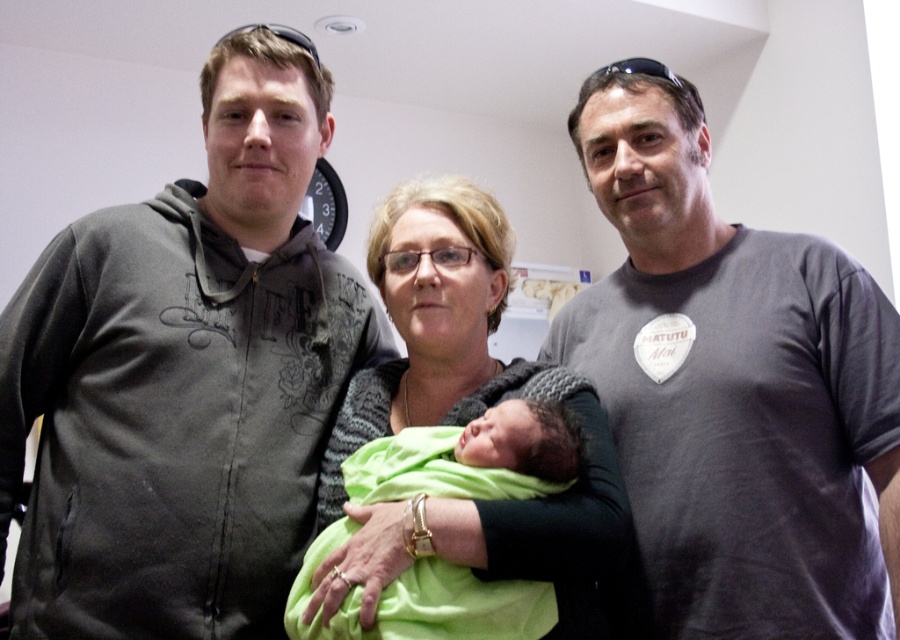
In the scene shown: You are standing in the hospital room and see the point marked at coordinates (387, 564). Is this point within arm reach?

The point at (387, 564) is 1.01 meters from the viewer, which is slightly beyond typical arm reach, so it cannot be reached.